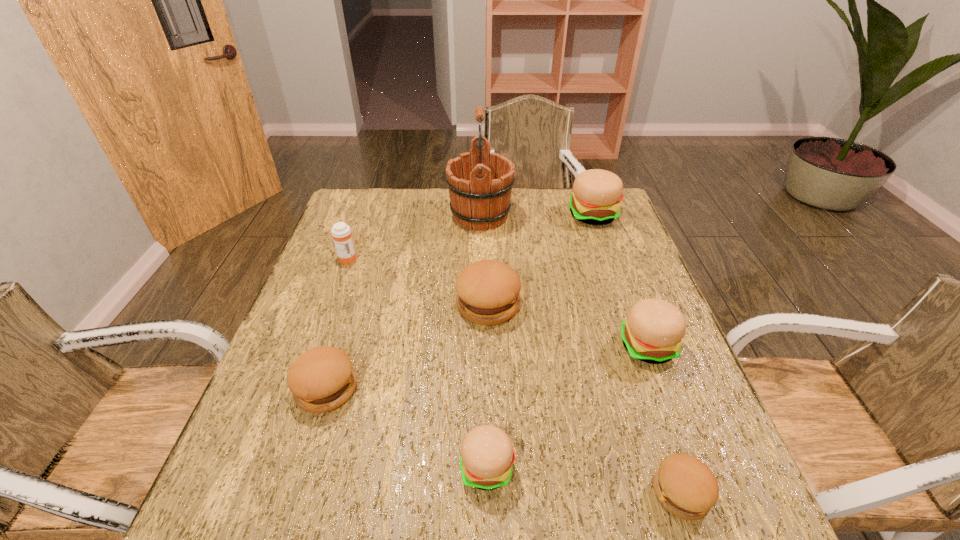
In order to click on free point between the tallest object and the second biggest beige hamburger in this screenshot , I will do `click(564, 281)`.

This screenshot has width=960, height=540. I want to click on free space between the smallest beige hamburger and the biggest beige hamburger, so click(540, 341).

I want to click on free area in between the sixth nearest object and the tallest hamburger, so click(x=469, y=237).

The height and width of the screenshot is (540, 960). I want to click on vacant space that's between the rightmost brown hamburger and the medicine, so click(x=514, y=376).

In order to click on free space between the second farthest beige hamburger and the leftmost brown hamburger in this screenshot , I will do `click(487, 367)`.

Identify the location of object that stands as the fifth closest to the smallest brown hamburger. (480, 183).

Locate which object ranks sixth in proximity to the leftmost brown hamburger. Please provide its 2D coordinates. Your answer should be formatted as a tuple, i.e. [(x, y)], where the tuple contains the x and y coordinates of a point satisfying the conditions above.

[(653, 331)]

Select which hamburger appears as the fifth closest to the orange medicine. Please provide its 2D coordinates. Your answer should be formatted as a tuple, i.e. [(x, y)], where the tuple contains the x and y coordinates of a point satisfying the conditions above.

[(653, 331)]

The height and width of the screenshot is (540, 960). In order to click on hamburger that can be found as the fifth closest to the rightmost brown hamburger in this screenshot , I will do `click(597, 193)`.

Find the location of a particular element. This screenshot has width=960, height=540. the closest beige hamburger to the second farthest beige hamburger is located at coordinates (487, 455).